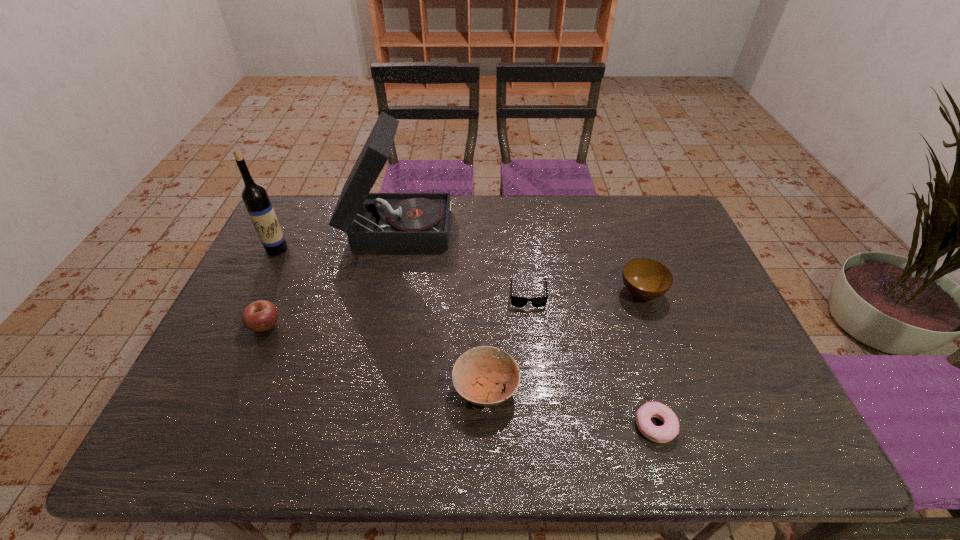
This screenshot has height=540, width=960. Find the location of `vacant area at the near edge`. vacant area at the near edge is located at coordinates (592, 428).

Identify the location of blank space at the left edge. The width and height of the screenshot is (960, 540). coord(284,299).

In the image, there is a desktop. Identify the location of free region at the right edge. The width and height of the screenshot is (960, 540). (732, 353).

This screenshot has width=960, height=540. I want to click on vacant area at the far left corner of the desktop, so click(x=300, y=207).

The image size is (960, 540). I want to click on vacant area at the far right corner of the desktop, so click(669, 232).

Identify the location of vacant region between the farther bowl and the phonograph_record. This screenshot has height=540, width=960. (519, 258).

Where is `blank region between the phonograph_record and the sixth tallest object`? The image size is (960, 540). blank region between the phonograph_record and the sixth tallest object is located at coordinates (463, 259).

This screenshot has width=960, height=540. What are the coordinates of `free space that is in between the left bowl and the wine bottle` in the screenshot? It's located at (381, 319).

What are the coordinates of `free area in between the nearer bowl and the apple` in the screenshot? It's located at (375, 357).

Where is `free spot between the right bowl and the wine bottle`? free spot between the right bowl and the wine bottle is located at coordinates (459, 271).